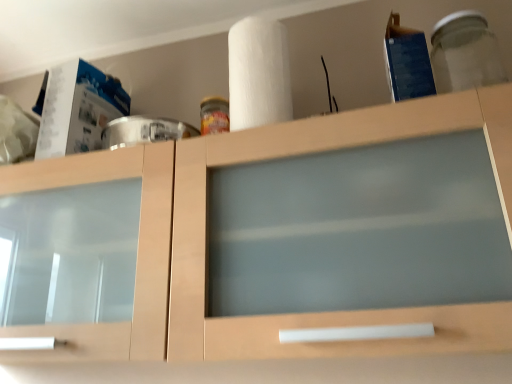
Question: Is the depth of matte wood cabinet at center greater than that of transparent glass jar at upper right?

Choices:
 (A) yes
 (B) no

Answer: (B)

Question: From a real-world perspective, does matte wood cabinet at center stand above transparent glass jar at upper right?

Choices:
 (A) yes
 (B) no

Answer: (B)

Question: Is matte wood cabinet at center directly adjacent to transparent glass jar at upper right?

Choices:
 (A) no
 (B) yes

Answer: (A)

Question: Is matte wood cabinet at center not near transparent glass jar at upper right?

Choices:
 (A) yes
 (B) no

Answer: (B)

Question: From the image's perspective, is matte wood cabinet at center beneath transparent glass jar at upper right?

Choices:
 (A) no
 (B) yes

Answer: (B)

Question: Is the depth of matte wood cabinet at center less than that of transparent glass jar at upper right?

Choices:
 (A) yes
 (B) no

Answer: (A)

Question: Considering the relative sizes of matte wood cabinet at center and white matte paper towel at upper center in the image provided, is matte wood cabinet at center taller than white matte paper towel at upper center?

Choices:
 (A) no
 (B) yes

Answer: (B)

Question: Can you confirm if matte wood cabinet at center is wider than white matte paper towel at upper center?

Choices:
 (A) no
 (B) yes

Answer: (B)

Question: Is matte wood cabinet at center positioned behind white matte paper towel at upper center?

Choices:
 (A) yes
 (B) no

Answer: (B)

Question: Could white matte paper towel at upper center be considered to be inside matte wood cabinet at center?

Choices:
 (A) no
 (B) yes

Answer: (A)

Question: Does matte wood cabinet at center have a smaller size compared to white matte paper towel at upper center?

Choices:
 (A) no
 (B) yes

Answer: (A)

Question: Is matte wood cabinet at center with white matte paper towel at upper center?

Choices:
 (A) yes
 (B) no

Answer: (B)

Question: Can we say transparent glass jar at upper right lies outside white matte paper towel at upper center?

Choices:
 (A) yes
 (B) no

Answer: (A)